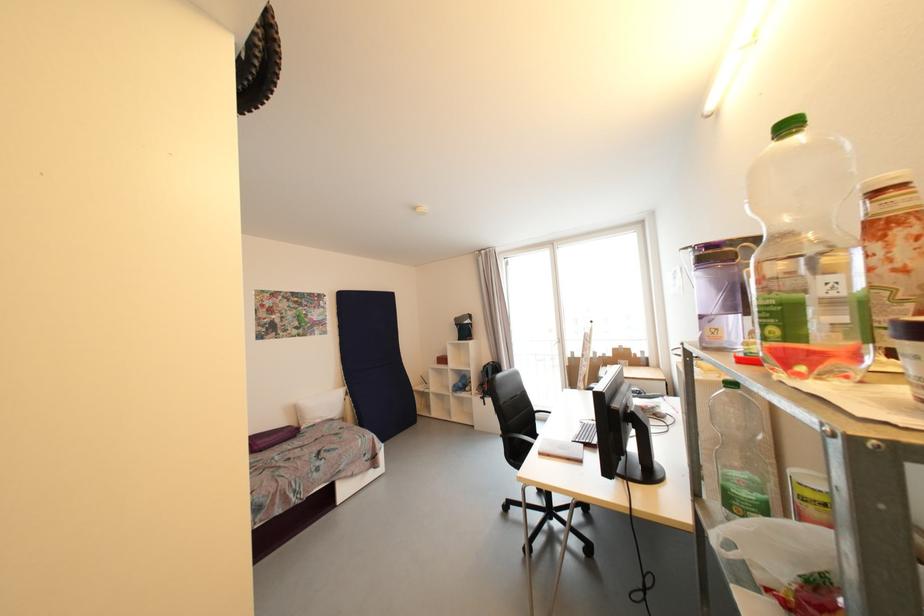
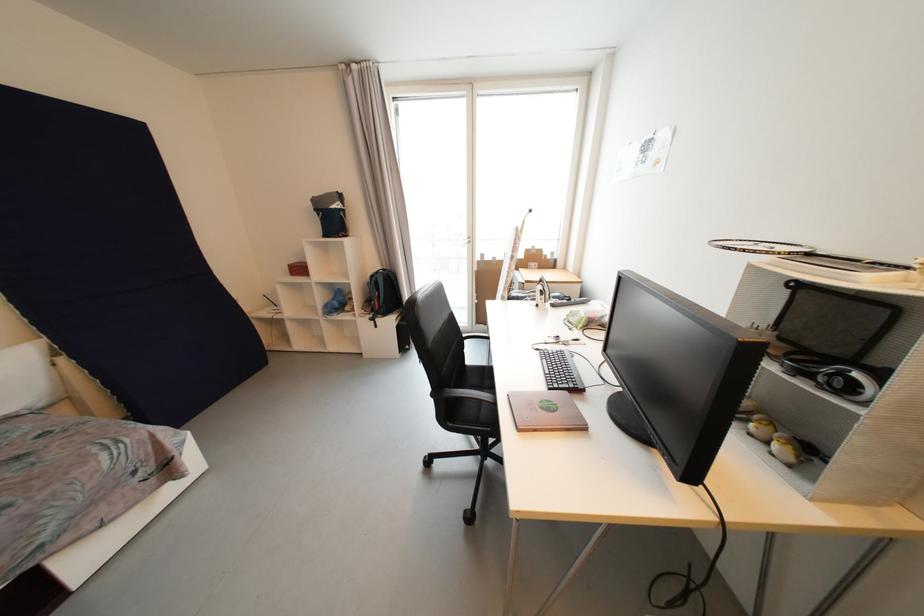
First-person continuous shooting, in which direction is the camera rotating?

The rotation direction of the camera is right-down.